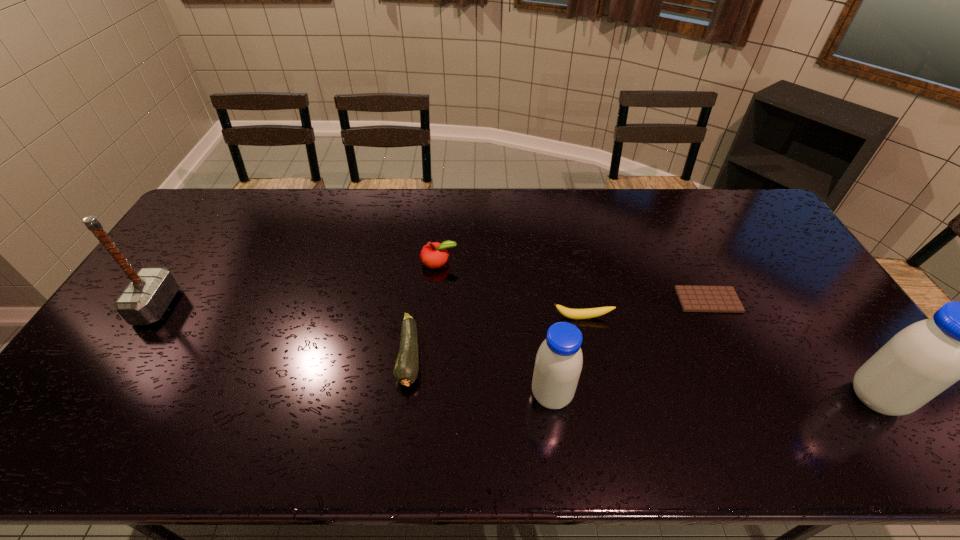
Where is `the third tallest object`? the third tallest object is located at coordinates (559, 360).

Identify the location of the left soya milk. This screenshot has width=960, height=540. (559, 360).

This screenshot has width=960, height=540. I want to click on the right soya milk, so click(x=921, y=361).

The image size is (960, 540). In order to click on the rightmost object in this screenshot , I will do `click(921, 361)`.

Locate an element on the screen. the farthest object is located at coordinates (434, 254).

This screenshot has width=960, height=540. I want to click on apple, so click(434, 254).

Image resolution: width=960 pixels, height=540 pixels. I want to click on hammer, so click(x=150, y=291).

Find the location of a particular element. This screenshot has height=540, width=960. banana is located at coordinates pos(567,312).

The width and height of the screenshot is (960, 540). In order to click on the second object from right to left in this screenshot , I will do `click(692, 298)`.

Locate an element on the screen. the shortest object is located at coordinates (692, 298).